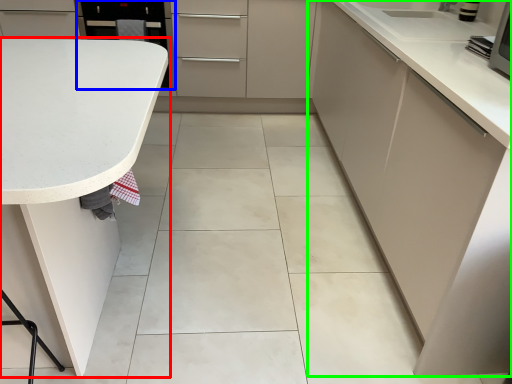
Question: Which is farther away from countertop (highlighted by a red box)? appliance (highlighted by a blue box) or cabinetry (highlighted by a green box)?

Choices:
 (A) appliance
 (B) cabinetry

Answer: (A)